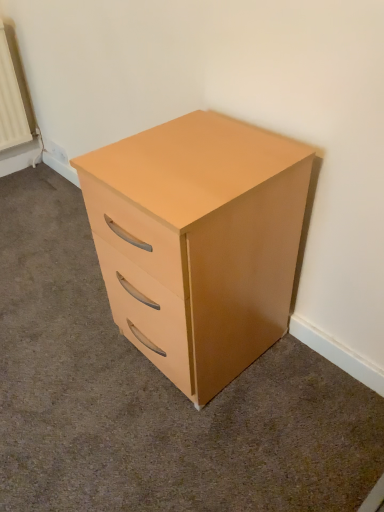
Locate an element on the screen. free space to the left of matte wood chest of drawers at center is located at coordinates (67, 350).